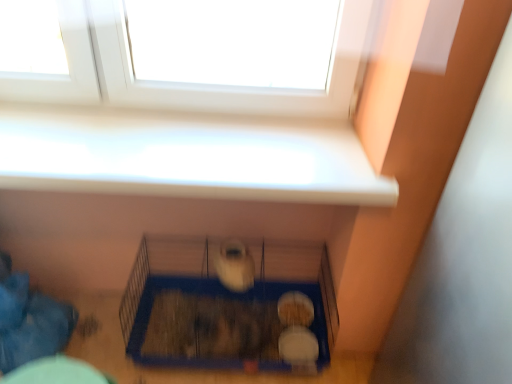
You are a GUI agent. You are given a task and a screenshot of the screen. Output one action in this format:
    pyautogui.click(x=<x>, y=<y>)
    Task: Click on the white plastic window at upper center
    
    Given the screenshot: What is the action you would take?
    pyautogui.click(x=185, y=158)

Describe the element at coordinates (185, 158) in the screenshot. I see `white plastic window at upper center` at that location.

Image resolution: width=512 pixels, height=384 pixels. What do you see at coordinates (230, 305) in the screenshot? I see `blue wire bird cage at center` at bounding box center [230, 305].

This screenshot has height=384, width=512. Identify the location of blue wire bird cage at center. (230, 305).

At what (x,y) coordinates should I click in order to perform the action: click on white plastic window at upper center. Please return your answer as a coordinate pair (x, y). The width and height of the screenshot is (512, 384). Looking at the image, I should click on (185, 158).

Does blue wire bird cage at center appear on the left side of white plastic window at upper center?

In fact, blue wire bird cage at center is to the right of white plastic window at upper center.

Considering their positions, is blue wire bird cage at center located in front of or behind white plastic window at upper center?

blue wire bird cage at center is behind white plastic window at upper center.

Is point (245, 324) positioned before point (73, 137)?

No, (245, 324) is behind (73, 137).

From the image's perspective, between blue wire bird cage at center and white plastic window at upper center, which one is located above?

white plastic window at upper center.

From a real-world perspective, which object rests below the other?

In real-world perspective, blue wire bird cage at center is lower.

Which of these two, blue wire bird cage at center or white plastic window at upper center, is thinner?

With smaller width is white plastic window at upper center.

Consider the image. Between blue wire bird cage at center and white plastic window at upper center, which one has less height?

Standing shorter between the two is white plastic window at upper center.

Between blue wire bird cage at center and white plastic window at upper center, which one has larger size?

blue wire bird cage at center.

Choose the correct answer: Is blue wire bird cage at center inside white plastic window at upper center or outside it?

blue wire bird cage at center is not inside white plastic window at upper center, it's outside.

Are blue wire bird cage at center and white plastic window at upper center far apart?

blue wire bird cage at center is actually quite close to white plastic window at upper center.

Is blue wire bird cage at center aimed at white plastic window at upper center?

No, blue wire bird cage at center is not facing towards white plastic window at upper center.

How different are the orientations of blue wire bird cage at center and white plastic window at upper center in degrees?

There is a 0.746-degree angle between the facing directions of blue wire bird cage at center and white plastic window at upper center.

How far apart are blue wire bird cage at center and white plastic window at upper center?

The distance of blue wire bird cage at center from white plastic window at upper center is 56.60 centimeters.

Find the location of a particular element. window above the blue wire bird cage at center (from the image's perspective) is located at coordinates (185, 158).

Which object is positioned more to the right, white plastic window at upper center or blue wire bird cage at center?

From the viewer's perspective, blue wire bird cage at center appears more on the right side.

Which object is more forward, white plastic window at upper center or blue wire bird cage at center?

white plastic window at upper center is more forward.

Considering the positions of point (25, 130) and point (253, 257), is point (25, 130) closer or farther from the camera than point (253, 257)?

Point (25, 130).

From the image's perspective, between white plastic window at upper center and blue wire bird cage at center, which one is located above?

white plastic window at upper center is shown above in the image.

From a real-world perspective, is white plastic window at upper center positioned under blue wire bird cage at center based on gravity?

No, from a real-world perspective, white plastic window at upper center is not under blue wire bird cage at center.

Looking at this image, can you confirm if white plastic window at upper center is wider than blue wire bird cage at center?

No, white plastic window at upper center is not wider than blue wire bird cage at center.

Between white plastic window at upper center and blue wire bird cage at center, which one has more height?

With more height is blue wire bird cage at center.

Between white plastic window at upper center and blue wire bird cage at center, which one has larger size?

blue wire bird cage at center is bigger.

Based on the photo, does white plastic window at upper center contain blue wire bird cage at center?

No, blue wire bird cage at center is located outside of white plastic window at upper center.

Is white plastic window at upper center not close to blue wire bird cage at center?

white plastic window at upper center is actually quite close to blue wire bird cage at center.

Is white plastic window at upper center aimed at blue wire bird cage at center?

No, white plastic window at upper center is not oriented towards blue wire bird cage at center.

Can you tell me how much white plastic window at upper center and blue wire bird cage at center differ in facing direction?

0.746 degrees.

Identify the location of window on the left of blue wire bird cage at center. This screenshot has width=512, height=384. (185, 158).

At what (x,y) coordinates should I click in order to perform the action: click on bird cage on the right of white plastic window at upper center. Please return your answer as a coordinate pair (x, y). Looking at the image, I should click on (230, 305).

Where is `window on the left of blue wire bird cage at center`? The image size is (512, 384). window on the left of blue wire bird cage at center is located at coordinates tap(185, 158).